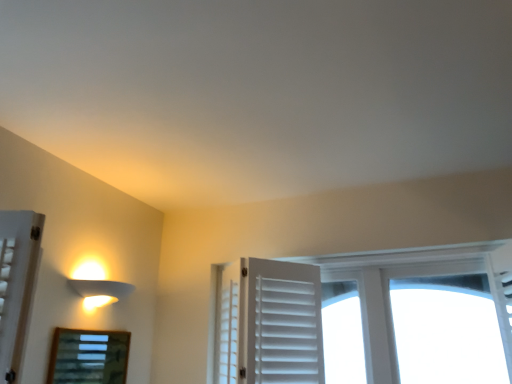
Describe the element at coordinates (88, 357) in the screenshot. This screenshot has height=384, width=512. I see `wooden framed mirror at lower left` at that location.

Image resolution: width=512 pixels, height=384 pixels. I want to click on wooden framed mirror at lower left, so click(88, 357).

What do you see at coordinates (97, 286) in the screenshot? I see `matte white lamp at left` at bounding box center [97, 286].

This screenshot has width=512, height=384. I want to click on matte white lamp at left, so click(97, 286).

Identify the location of wooden framed mirror at lower left. (88, 357).

Would you say wooden framed mirror at lower left is to the left or to the right of matte white lamp at left in the picture?

Based on their positions, wooden framed mirror at lower left is located to the left of matte white lamp at left.

Is wooden framed mirror at lower left closer to the viewer compared to matte white lamp at left?

Yes, the depth of wooden framed mirror at lower left is less than that of matte white lamp at left.

Does point (99, 359) come closer to viewer compared to point (100, 297)?

Yes, point (99, 359) is closer to viewer.

From the image's perspective, is wooden framed mirror at lower left located above or below matte white lamp at left?

Clearly, from the image's perspective, wooden framed mirror at lower left is below matte white lamp at left.

From a real-world perspective, is wooden framed mirror at lower left over matte white lamp at left?

Incorrect, from a real-world perspective, wooden framed mirror at lower left is lower than matte white lamp at left.

Looking at this image, is wooden framed mirror at lower left wider or thinner than matte white lamp at left?

In the image, wooden framed mirror at lower left appears to be more narrow than matte white lamp at left.

Which of these two, wooden framed mirror at lower left or matte white lamp at left, stands taller?

wooden framed mirror at lower left is taller.

Is wooden framed mirror at lower left bigger or smaller than matte white lamp at left?

Considering their sizes, wooden framed mirror at lower left takes up less space than matte white lamp at left.

Is wooden framed mirror at lower left inside the boundaries of matte white lamp at left, or outside?

wooden framed mirror at lower left cannot be found inside matte white lamp at left.

Would you consider wooden framed mirror at lower left to be distant from matte white lamp at left?

Actually, wooden framed mirror at lower left and matte white lamp at left are a little close together.

Is wooden framed mirror at lower left looking in the opposite direction of matte white lamp at left?

No, wooden framed mirror at lower left is not facing the opposite direction of matte white lamp at left.

Find the location of a particular element. This screenshot has width=512, height=384. lamp that is on the right side of wooden framed mirror at lower left is located at coordinates (97, 286).

Which object is positioned more to the right, matte white lamp at left or wooden framed mirror at lower left?

Positioned to the right is matte white lamp at left.

Is matte white lamp at left in front of wooden framed mirror at lower left?

→ That is False.

Is point (104, 285) closer or farther from the camera than point (123, 366)?

Point (104, 285) appears to be closer to the viewer than point (123, 366).

From the image's perspective, is matte white lamp at left over wooden framed mirror at lower left?

Indeed, from the image's perspective, matte white lamp at left is shown above wooden framed mirror at lower left.

From a real-world perspective, is matte white lamp at left located higher than wooden framed mirror at lower left?

Indeed, from a real-world perspective, matte white lamp at left stands above wooden framed mirror at lower left.

Which object is wider, matte white lamp at left or wooden framed mirror at lower left?

Wider between the two is matte white lamp at left.

Is matte white lamp at left taller than wooden framed mirror at lower left?

Incorrect, the height of matte white lamp at left is not larger of that of wooden framed mirror at lower left.

Who is smaller, matte white lamp at left or wooden framed mirror at lower left?

Smaller between the two is wooden framed mirror at lower left.

Consider the image. Is matte white lamp at left positioned beyond the bounds of wooden framed mirror at lower left?

That's correct, matte white lamp at left is outside of wooden framed mirror at lower left.

Is matte white lamp at left next to wooden framed mirror at lower left and touching it?

No, matte white lamp at left is not next to wooden framed mirror at lower left.

Is matte white lamp at left looking in the opposite direction of wooden framed mirror at lower left?

matte white lamp at left does not have its back to wooden framed mirror at lower left.

How different are the orientations of matte white lamp at left and wooden framed mirror at lower left in degrees?

0.427 degrees separate the facing orientations of matte white lamp at left and wooden framed mirror at lower left.

How far apart are matte white lamp at left and wooden framed mirror at lower left?

A distance of 8.90 inches exists between matte white lamp at left and wooden framed mirror at lower left.

Find the location of a particular element. The image size is (512, 384). bay window that is under the matte white lamp at left (from a real-world perspective) is located at coordinates (88, 357).

The image size is (512, 384). Identify the location of lamp that is on the right side of wooden framed mirror at lower left. point(97,286).

You are a GUI agent. You are given a task and a screenshot of the screen. Output one action in this format:
    pyautogui.click(x=<x>, y=<y>)
    Task: Click on the bay window lying on the left of matte white lamp at left
    This screenshot has height=384, width=512.
    Given the screenshot: What is the action you would take?
    pyautogui.click(x=88, y=357)